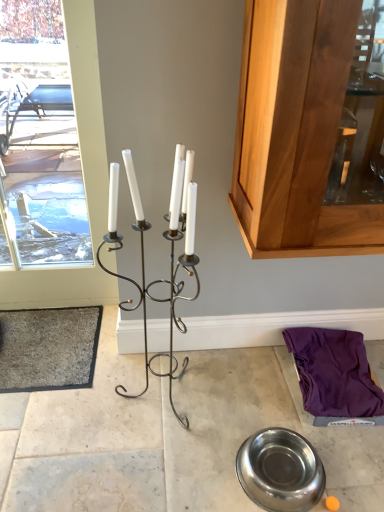
Question: From the image's perspective, is gray carpet at lower left below white glass window at left?

Choices:
 (A) yes
 (B) no

Answer: (A)

Question: Is gray carpet at lower left next to white glass window at left and touching it?

Choices:
 (A) yes
 (B) no

Answer: (B)

Question: From a real-world perspective, is gray carpet at lower left on white glass window at left?

Choices:
 (A) yes
 (B) no

Answer: (B)

Question: Can you confirm if gray carpet at lower left is taller than white glass window at left?

Choices:
 (A) no
 (B) yes

Answer: (A)

Question: From the image's perspective, is gray carpet at lower left on white glass window at left?

Choices:
 (A) yes
 (B) no

Answer: (B)

Question: Is gray carpet at lower left wider than white glass window at left?

Choices:
 (A) yes
 (B) no

Answer: (A)

Question: From the image's perspective, would you say black wrought iron candle holder at center is positioned over white glass window at left?

Choices:
 (A) no
 (B) yes

Answer: (A)

Question: Is black wrought iron candle holder at center completely or partially outside of white glass window at left?

Choices:
 (A) yes
 (B) no

Answer: (A)

Question: Does black wrought iron candle holder at center come behind white glass window at left?

Choices:
 (A) no
 (B) yes

Answer: (A)

Question: Is black wrought iron candle holder at center turned away from white glass window at left?

Choices:
 (A) no
 (B) yes

Answer: (A)

Question: Is black wrought iron candle holder at center taller than white glass window at left?

Choices:
 (A) no
 (B) yes

Answer: (A)

Question: Is black wrought iron candle holder at center wider than white glass window at left?

Choices:
 (A) no
 (B) yes

Answer: (B)

Question: Would you say polished stainless steel bowl at lower center is part of gray carpet at lower left's contents?

Choices:
 (A) yes
 (B) no

Answer: (B)